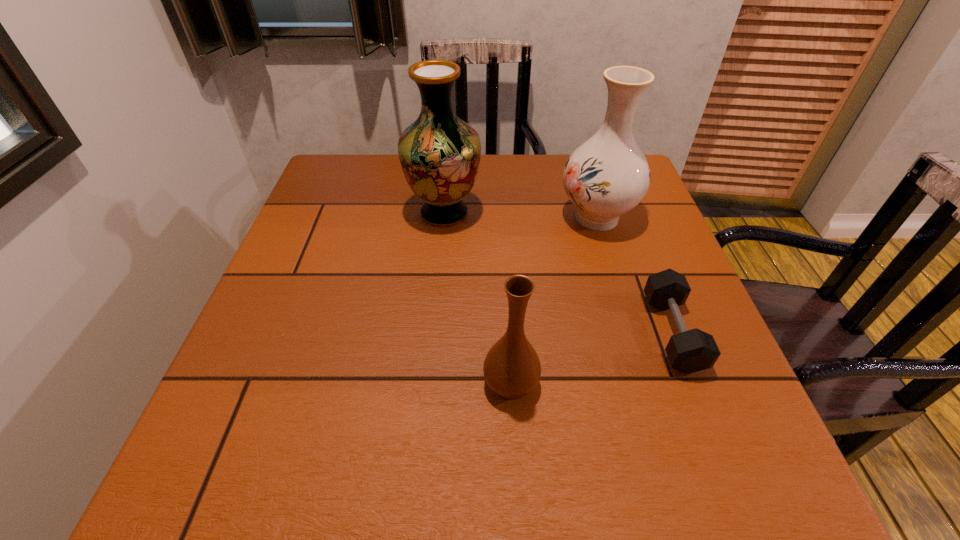
Where is `the leftmost vase`? the leftmost vase is located at coordinates (439, 153).

The image size is (960, 540). I want to click on the rightmost vase, so click(608, 175).

Find the location of a particular element. This screenshot has width=960, height=540. the second vase from left to right is located at coordinates (512, 369).

Find the location of a particular element. the nearest vase is located at coordinates (512, 369).

Identify the location of dumbbell. (689, 351).

Locate an element on the screen. free space located 0.050m on the right of the leftmost vase is located at coordinates (501, 213).

The height and width of the screenshot is (540, 960). What are the coordinates of `vacant space located on the front of the rightmost vase` in the screenshot? It's located at (651, 395).

Locate an element on the screen. This screenshot has width=960, height=540. blank space located 0.090m on the front of the third tallest object is located at coordinates (516, 464).

The height and width of the screenshot is (540, 960). I want to click on vacant space situated on the back of the dumbbell, so click(x=633, y=230).

The width and height of the screenshot is (960, 540). Identify the location of vase that is at the right edge. (608, 175).